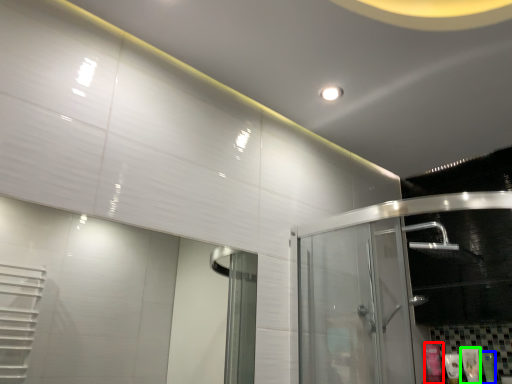
Question: Considering the real-world distances, which object is farthest from toiletry (highlighted by a red box)? toiletry (highlighted by a blue box) or toiletry (highlighted by a green box)?

Choices:
 (A) toiletry
 (B) toiletry

Answer: (A)